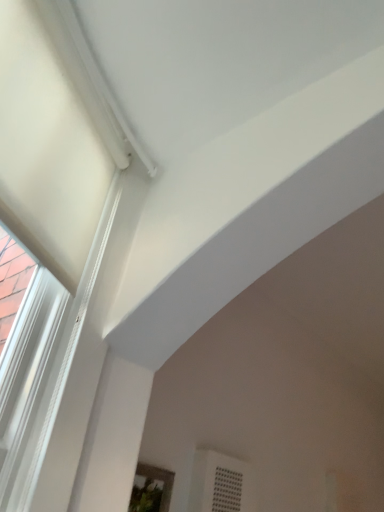
This screenshot has width=384, height=512. Describe the element at coordinates (221, 483) in the screenshot. I see `white plastic air conditioning unit at lower center` at that location.

Identify the location of white plastic air conditioning unit at lower center. This screenshot has width=384, height=512. (221, 483).

In order to click on white plastic air conditioning unit at lower center in this screenshot , I will do `click(221, 483)`.